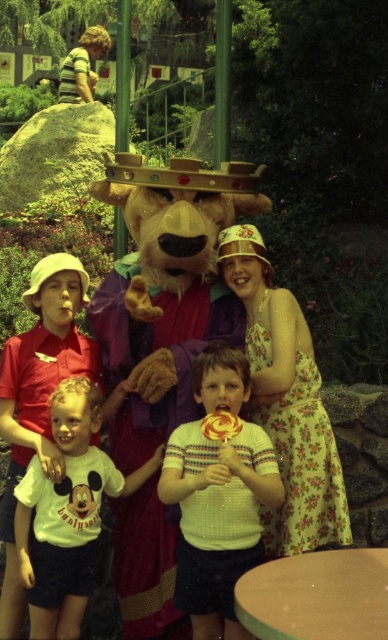
Based on the scene description, where is the fuzzy brown bear at center located in terms of its 2D coordinates?

The fuzzy brown bear at center is located at the 2D coordinates of point (164, 292).